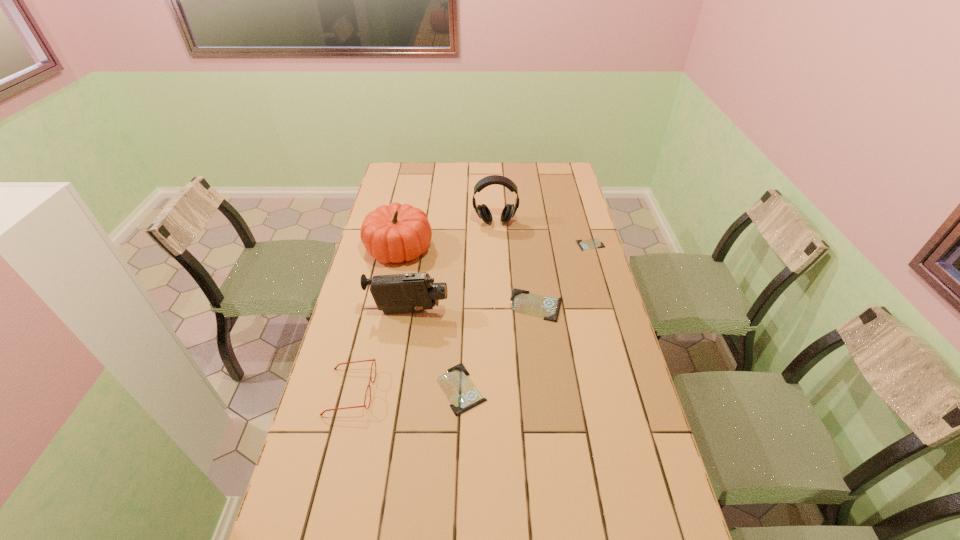
With all identity cards evenly spaced, where should an extra identity card be placed on the left to continue the pattern? Please point out a vacant space. Please provide its 2D coordinates. Your answer should be formatted as a tuple, i.e. [(x, y)], where the tuple contains the x and y coordinates of a point satisfying the conditions above.

[(351, 511)]